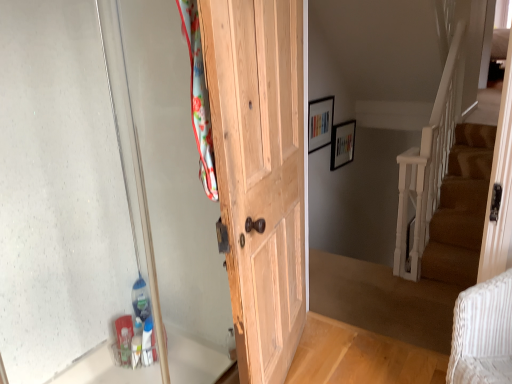
The height and width of the screenshot is (384, 512). What are the coordinates of `wooden picture frame at upper center, placed as the 1th picture frame when sorted from right to left` in the screenshot? It's located at (342, 144).

Measure the distance between wooden picture frame at upper center, the second picture frame positioned from the back, and camera.

wooden picture frame at upper center, the second picture frame positioned from the back, is 11.30 feet away from camera.

You are a GUI agent. You are given a task and a screenshot of the screen. Output one action in this format:
    pyautogui.click(x=<x>, y=<y>)
    Task: Click on the natural wood door at center
    The image size is (512, 384).
    Given the screenshot: What is the action you would take?
    pyautogui.click(x=260, y=172)

Which object is further away from the camera, wooden picture frame at upper center, the 2th picture frame viewed from the left, or natural wood door at center?

Positioned behind is wooden picture frame at upper center, the 2th picture frame viewed from the left.

Consider the image. Would you say natural wood door at center is part of wooden picture frame at upper center, the 2th picture frame viewed from the left,'s contents?

No, natural wood door at center is not a part of wooden picture frame at upper center, the 2th picture frame viewed from the left.

Would you consider wooden picture frame at upper center, the 2th picture frame viewed from the left, to be distant from natural wood door at center?

That's right, there is a large distance between wooden picture frame at upper center, the 2th picture frame viewed from the left, and natural wood door at center.

From the image's perspective, does wooden picture frame at upper center, arranged as the first picture frame when viewed from the back, appear lower than natural wood door at center?

No.

Is wooden picture frame at upper center, which is counted as the first picture frame, starting from the front, outside of wooden picture frame at upper center, placed as the 1th picture frame when sorted from right to left?

Indeed, wooden picture frame at upper center, which is counted as the first picture frame, starting from the front, is completely outside wooden picture frame at upper center, placed as the 1th picture frame when sorted from right to left.

From the image's perspective, is wooden picture frame at upper center, the second picture frame positioned from the back, on wooden picture frame at upper center, placed as the 1th picture frame when sorted from right to left?

Indeed, from the image's perspective, wooden picture frame at upper center, the second picture frame positioned from the back, is shown above wooden picture frame at upper center, placed as the 1th picture frame when sorted from right to left.

Are wooden picture frame at upper center, positioned as the second picture frame in right-to-left order, and wooden picture frame at upper center, placed as the 1th picture frame when sorted from right to left, beside each other?

No, wooden picture frame at upper center, positioned as the second picture frame in right-to-left order, is not beside wooden picture frame at upper center, placed as the 1th picture frame when sorted from right to left.

Considering the sizes of objects wooden picture frame at upper center, which is counted as the first picture frame, starting from the front, and wooden picture frame at upper center, which is counted as the 2th picture frame, starting from the front, in the image provided, who is wider, wooden picture frame at upper center, which is counted as the first picture frame, starting from the front, or wooden picture frame at upper center, which is counted as the 2th picture frame, starting from the front,?

wooden picture frame at upper center, which is counted as the 2th picture frame, starting from the front, is wider.

Considering the relative sizes of wooden picture frame at upper center, arranged as the first picture frame when viewed from the back, and transparent glass door at left in the image provided, is wooden picture frame at upper center, arranged as the first picture frame when viewed from the back, shorter than transparent glass door at left?

Yes, wooden picture frame at upper center, arranged as the first picture frame when viewed from the back, is shorter than transparent glass door at left.

Is point (343, 162) closer to camera compared to point (93, 230)?

No.

Could transparent glass door at left be considered to be inside wooden picture frame at upper center, which is counted as the 2th picture frame, starting from the front?

Actually, transparent glass door at left is outside wooden picture frame at upper center, which is counted as the 2th picture frame, starting from the front.

How distant is wooden picture frame at upper center, which is counted as the 2th picture frame, starting from the front, from transparent glass door at left?

wooden picture frame at upper center, which is counted as the 2th picture frame, starting from the front, is 9.50 feet away from transparent glass door at left.

Considering the relative sizes of transparent glass door at left and wooden picture frame at upper center, the second picture frame positioned from the back, in the image provided, is transparent glass door at left taller than wooden picture frame at upper center, the second picture frame positioned from the back,?

Correct, transparent glass door at left is much taller as wooden picture frame at upper center, the second picture frame positioned from the back.

From a real-world perspective, is transparent glass door at left above or below wooden picture frame at upper center, the 1th picture frame positioned from the left?

transparent glass door at left is above wooden picture frame at upper center, the 1th picture frame positioned from the left.

Based on the photo, how distant is transparent glass door at left from wooden picture frame at upper center, which is counted as the first picture frame, starting from the front?

2.21 meters.

Which point is more distant from viewer, (x=318, y=133) or (x=287, y=340)?

The point (x=318, y=133) is more distant.

Is wooden picture frame at upper center, the 1th picture frame positioned from the left, oriented away from natural wood door at center?

wooden picture frame at upper center, the 1th picture frame positioned from the left, does not have its back to natural wood door at center.

Considering the sizes of wooden picture frame at upper center, the second picture frame positioned from the back, and natural wood door at center in the image, is wooden picture frame at upper center, the second picture frame positioned from the back, wider or thinner than natural wood door at center?

Clearly, wooden picture frame at upper center, the second picture frame positioned from the back, has less width compared to natural wood door at center.

From the image's perspective, between wooden picture frame at upper center, the 1th picture frame positioned from the left, and natural wood door at center, which one is located above?

wooden picture frame at upper center, the 1th picture frame positioned from the left, from the image's perspective.

Based on the photo, is transparent glass door at left wider than wooden picture frame at upper center, arranged as the first picture frame when viewed from the back?

No.

From a real-world perspective, which is physically below, transparent glass door at left or wooden picture frame at upper center, the 2th picture frame viewed from the left?

wooden picture frame at upper center, the 2th picture frame viewed from the left.

Considering the positions of point (51, 321) and point (354, 140), is point (51, 321) closer or farther from the camera than point (354, 140)?

Clearly, point (51, 321) is closer to the camera than point (354, 140).

Is transparent glass door at left aimed at wooden picture frame at upper center, placed as the 1th picture frame when sorted from right to left?

No, transparent glass door at left is not oriented towards wooden picture frame at upper center, placed as the 1th picture frame when sorted from right to left.

Would you say transparent glass door at left is a long distance from natural wood door at center?

No.

Is transparent glass door at left oriented towards natural wood door at center?

No, transparent glass door at left is not facing towards natural wood door at center.

Is the position of transparent glass door at left less distant than that of natural wood door at center?

Yes, the depth of transparent glass door at left is less than that of natural wood door at center.

Locate an element on the screen. This screenshot has width=512, height=384. picture frame that is the 2nd object located behind the natural wood door at center is located at coordinates (342, 144).

This screenshot has width=512, height=384. I want to click on picture frame that is on the right side of wooden picture frame at upper center, which is counted as the first picture frame, starting from the front, so tap(342, 144).

Looking at the image, which one is located further to wooden picture frame at upper center, the second picture frame positioned from the back, transparent glass door at left or natural wood door at center?

transparent glass door at left is positioned further to the anchor wooden picture frame at upper center, the second picture frame positioned from the back.

Considering their positions, is wooden picture frame at upper center, placed as the 1th picture frame when sorted from right to left, positioned further to natural wood door at center than transparent glass door at left?

Among the two, wooden picture frame at upper center, placed as the 1th picture frame when sorted from right to left, is located further to natural wood door at center.

Looking at the image, which one is located further to natural wood door at center, wooden picture frame at upper center, the second picture frame positioned from the back, or transparent glass door at left?

The object further to natural wood door at center is wooden picture frame at upper center, the second picture frame positioned from the back.

From the image, which object appears to be nearer to transparent glass door at left, natural wood door at center or wooden picture frame at upper center, which is counted as the 2th picture frame, starting from the front?

natural wood door at center is closer to transparent glass door at left.

From the image, which object appears to be nearer to wooden picture frame at upper center, which is counted as the 2th picture frame, starting from the front, transparent glass door at left or natural wood door at center?

The object closer to wooden picture frame at upper center, which is counted as the 2th picture frame, starting from the front, is natural wood door at center.

Considering their positions, is natural wood door at center positioned further to transparent glass door at left than wooden picture frame at upper center, which is counted as the first picture frame, starting from the front?

Among the two, wooden picture frame at upper center, which is counted as the first picture frame, starting from the front, is located further to transparent glass door at left.

In the scene shown: When comparing their distances from wooden picture frame at upper center, placed as the 1th picture frame when sorted from right to left, does transparent glass door at left or wooden picture frame at upper center, positioned as the second picture frame in right-to-left order, seem closer?

wooden picture frame at upper center, positioned as the second picture frame in right-to-left order, is positioned closer to the anchor wooden picture frame at upper center, placed as the 1th picture frame when sorted from right to left.

Looking at the image, which one is located further to natural wood door at center, transparent glass door at left or wooden picture frame at upper center, arranged as the first picture frame when viewed from the back?

wooden picture frame at upper center, arranged as the first picture frame when viewed from the back, lies further to natural wood door at center than the other object.

Where is `picture frame between transparent glass door at left and wooden picture frame at upper center, the 2th picture frame viewed from the left, from front to back`? The image size is (512, 384). picture frame between transparent glass door at left and wooden picture frame at upper center, the 2th picture frame viewed from the left, from front to back is located at coordinates (320, 123).

Identify the location of door between transparent glass door at left and wooden picture frame at upper center, the 1th picture frame positioned from the left, in the front-back direction. (260, 172).

This screenshot has height=384, width=512. In order to click on picture frame between natural wood door at center and wooden picture frame at upper center, placed as the 1th picture frame when sorted from right to left, from front to back in this screenshot , I will do `click(320, 123)`.

This screenshot has height=384, width=512. I want to click on door between transparent glass door at left and wooden picture frame at upper center, arranged as the first picture frame when viewed from the back, along the z-axis, so click(x=260, y=172).